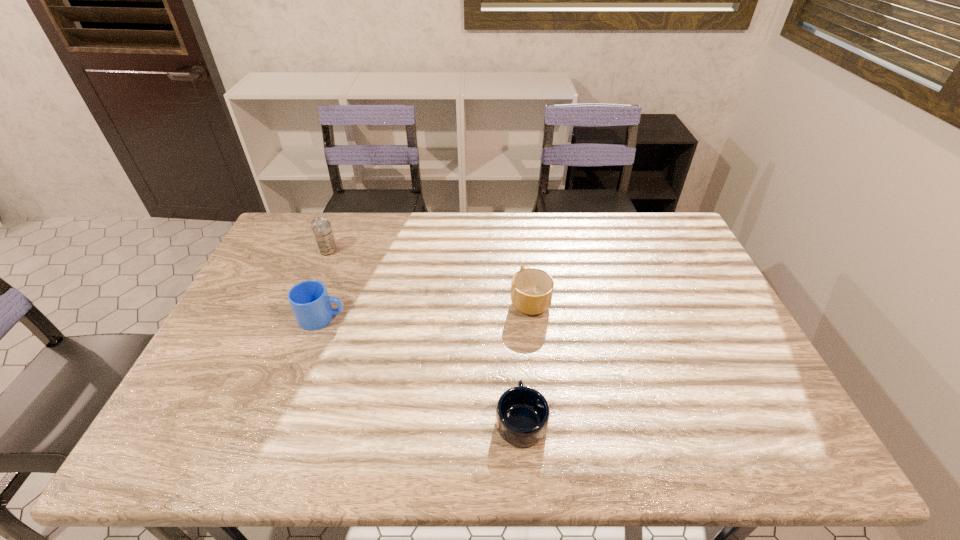
Find the location of a particular element. The height and width of the screenshot is (540, 960). object present at the near edge is located at coordinates (522, 414).

Locate an element on the screen. The height and width of the screenshot is (540, 960). free location at the far edge is located at coordinates (452, 219).

Identify the location of vacant area at the left edge of the desktop. This screenshot has width=960, height=540. (225, 325).

Identify the location of vacant space at the right edge of the desktop. This screenshot has width=960, height=540. (702, 364).

The width and height of the screenshot is (960, 540). I want to click on free location at the far left corner of the desktop, so click(325, 213).

In the image, there is a desktop. In order to click on vacant space at the near left corner in this screenshot , I will do `click(187, 460)`.

This screenshot has height=540, width=960. I want to click on vacant region between the leftmost mug and the nearest mug, so click(421, 369).

Locate an element on the screen. The width and height of the screenshot is (960, 540). free spot between the beer can and the shortest mug is located at coordinates [424, 335].

This screenshot has height=540, width=960. I want to click on blank region between the nearest mug and the leftmost mug, so click(x=421, y=369).

Image resolution: width=960 pixels, height=540 pixels. Find the location of `vacant area between the shortest object and the leftmost mug`. vacant area between the shortest object and the leftmost mug is located at coordinates (421, 369).